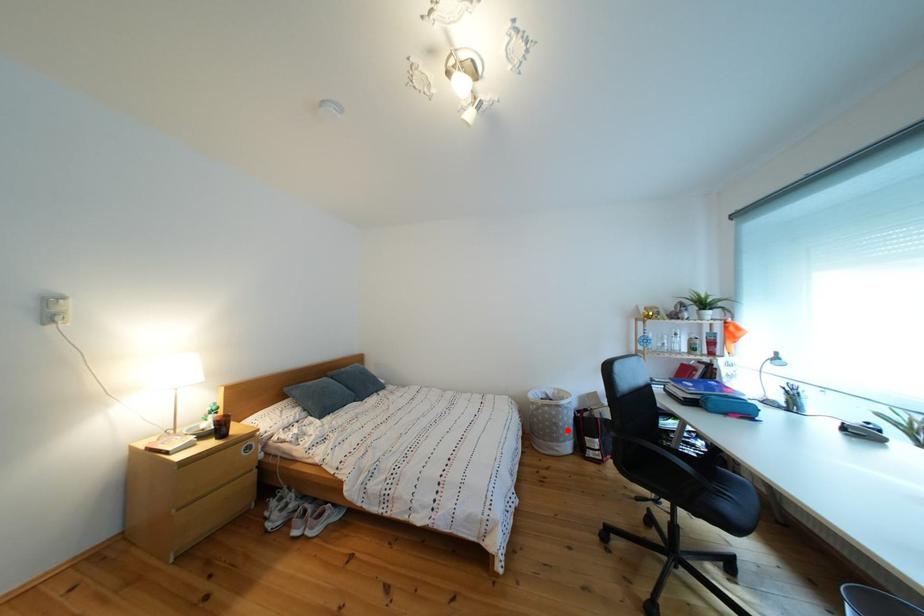
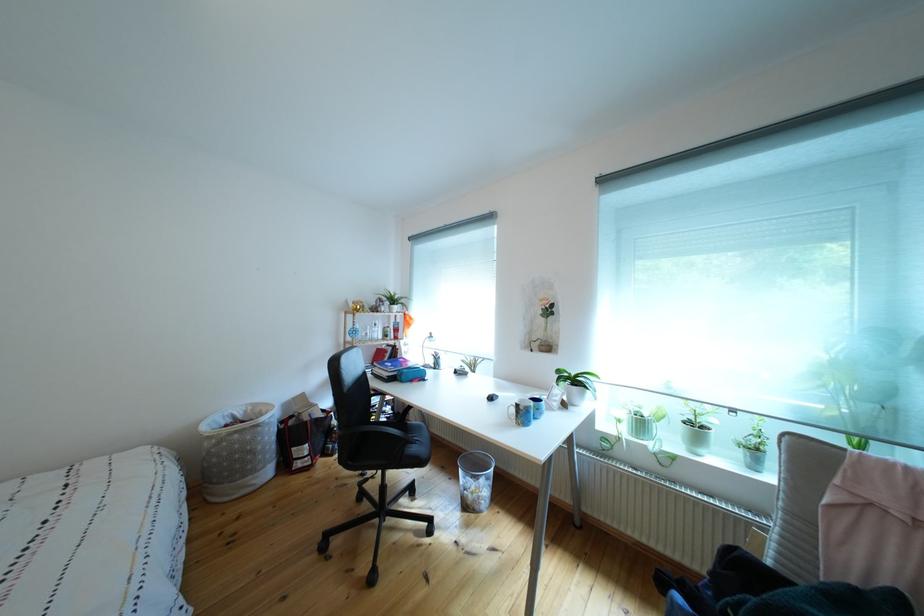
Locate, in the second image, the point that corresponds to the highlighted location in the first image.

(263, 456)